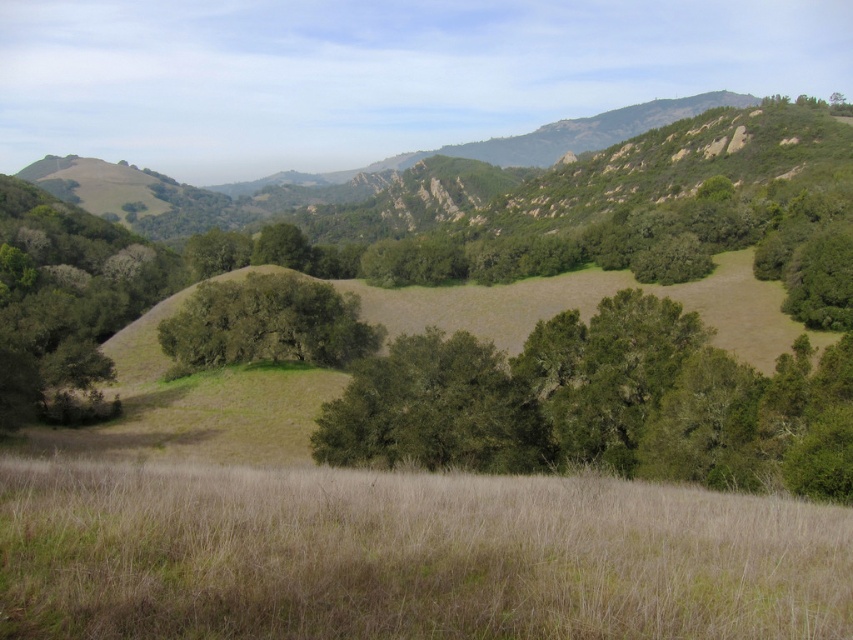
You are standing in the field with dry grass at lower center and looking towards the green leafy tree at center. Which object appears closer to you?

The dry grass at lower center appears closer to you because it is positioned in the foreground of the scene compared to the green leafy tree at center, which is located further back in the midground.

Consider the image. You are standing at the point marked as point (405, 556) in the image. What type of terrain are you currently standing on?

You are standing on dry grass at lower center, as the dry grass at lower center is located at point (405, 556).

You are standing at the point with coordinates point [270,316] and want to walk towards the point with coordinates point [514,483]. Which direction should you move relative to your current position?

You should move forward because point [514,483] is in front of point [270,316].